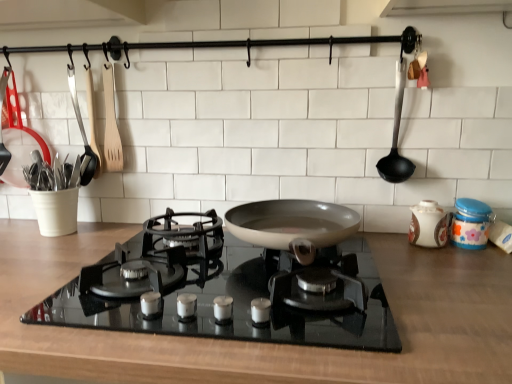
You are a GUI agent. You are given a task and a screenshot of the screen. Output one action in this format:
    pyautogui.click(x=<x>, y=<y>)
    Task: Click on the vacant space in front of blue glossy jar at right, the 5th kitchen appliance from the left
    This screenshot has height=384, width=512.
    Given the screenshot: What is the action you would take?
    pyautogui.click(x=475, y=265)